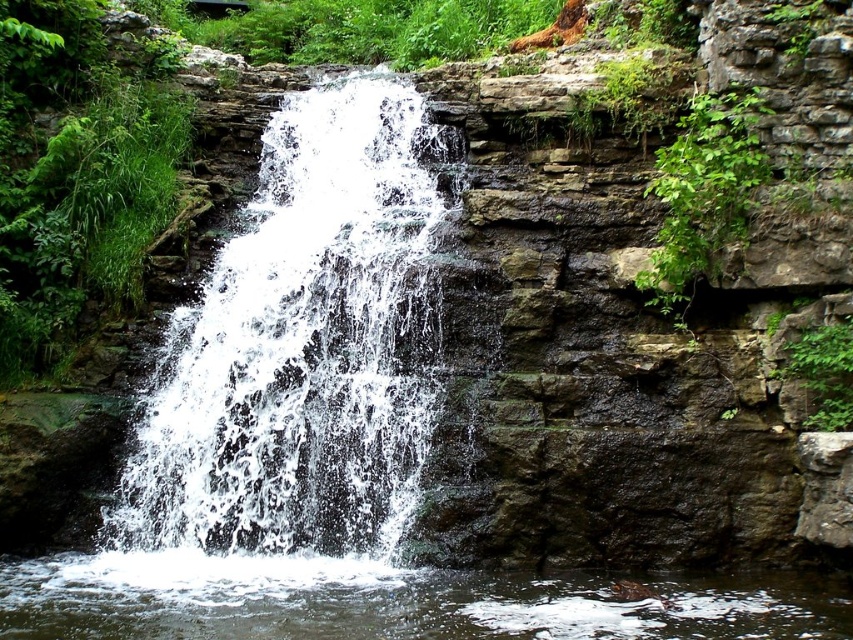
You are standing at the edge of the cliff overlooking the waterfall. You notice the white frothy water at center and the clear water at bottom center. Which one is higher in elevation?

The white frothy water at center is taller than clear water at bottom center, so it is higher in elevation.

You are standing at the edge of the cliff overlooking the waterfall. You want to throw a small pebble into the white frothy water at center. Based on the distance provided, can you estimate if a typical human can accurately throw the pebble that far?

The white frothy water at center is 25.24 meters away from the viewer. A typical human can throw a pebble about 20 to 30 meters, so it is possible but requires a strong throw.

You are a photographer aiming to capture the waterfall and its surroundings. You notice the white frothy water at center and the clear water at bottom center. Which of these two water features is located to the left when viewed from the photographer perspective facing the waterfall?

The white frothy water at center is positioned on the left side of clear water at bottom center, so when viewed from the photographer perspective facing the waterfall, the white frothy water at center is located to the left.